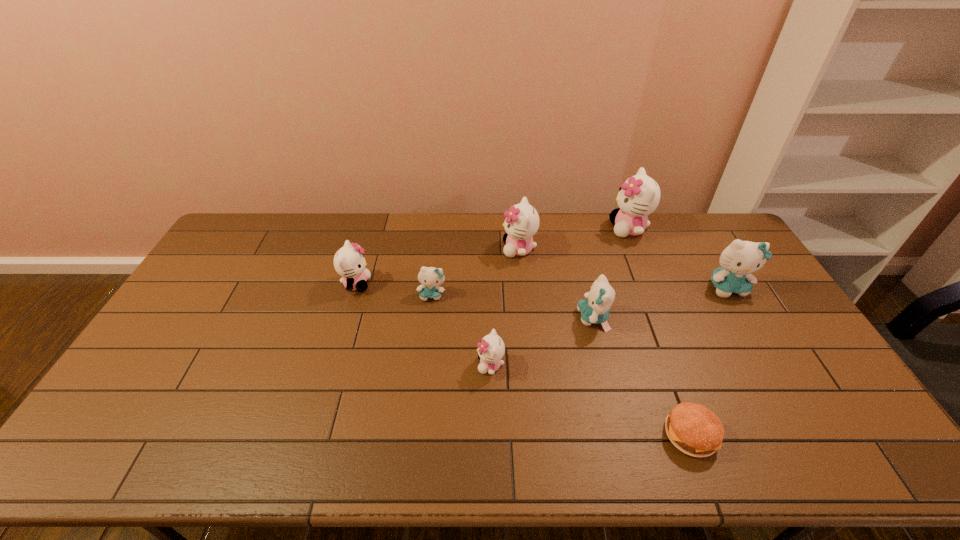
Identify the location of blank space located 0.270m on the face of the leftmost blue kitten. (423, 374).

Identify the location of vacant area situated on the right of the nearest object. This screenshot has width=960, height=540. (841, 434).

Locate an element on the screen. The image size is (960, 540). object that is at the near edge is located at coordinates (694, 429).

Locate an element on the screen. Image resolution: width=960 pixels, height=540 pixels. object that is positioned at the right edge is located at coordinates (741, 258).

Find the location of a particular element. The height and width of the screenshot is (540, 960). free space at the far edge is located at coordinates (649, 235).

Locate an element on the screen. vacant space at the near edge of the desktop is located at coordinates (496, 435).

The width and height of the screenshot is (960, 540). I want to click on vacant position at the left edge of the desktop, so click(186, 313).

Identify the location of free region at the right edge of the desktop. (862, 427).

Where is `free space at the far right corner`? free space at the far right corner is located at coordinates pyautogui.click(x=703, y=242).

This screenshot has height=540, width=960. In order to click on vacant space in between the sixth kitten from left to right and the second white kitten from right to left in this screenshot , I will do pos(574,239).